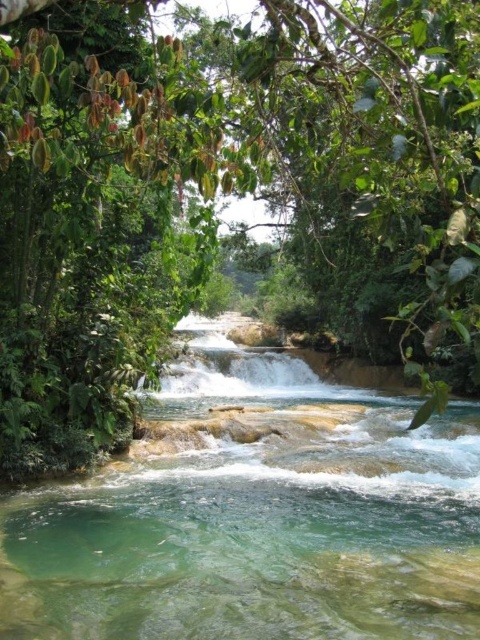
You are standing at the edge of the river and see a point marked at coordinates (232,193). According to the scene description, what object is located at that point?

The point at coordinates (232,193) indicates a green leafy tree at center.

You are standing at the edge of the river and notice a green leafy tree at center and a clear water stream at center. Which object is positioned to the left of the other?

The green leafy tree at center is to the left of the clear water stream at center.

You are standing at the origin point of the scene. Where is the green leafy tree at center located?

The green leafy tree at center is located at point 0.303 on the x axis and 0.485 on the y axis.